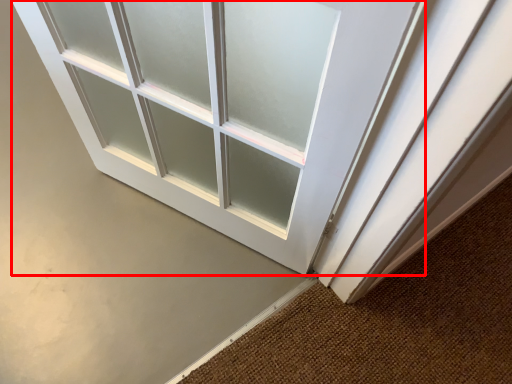
Question: From the image's perspective, considering the relative positions of door (annotated by the red box) and doormat in the image provided, where is door (annotated by the red box) located with respect to the staircase?

Choices:
 (A) below
 (B) above

Answer: (B)